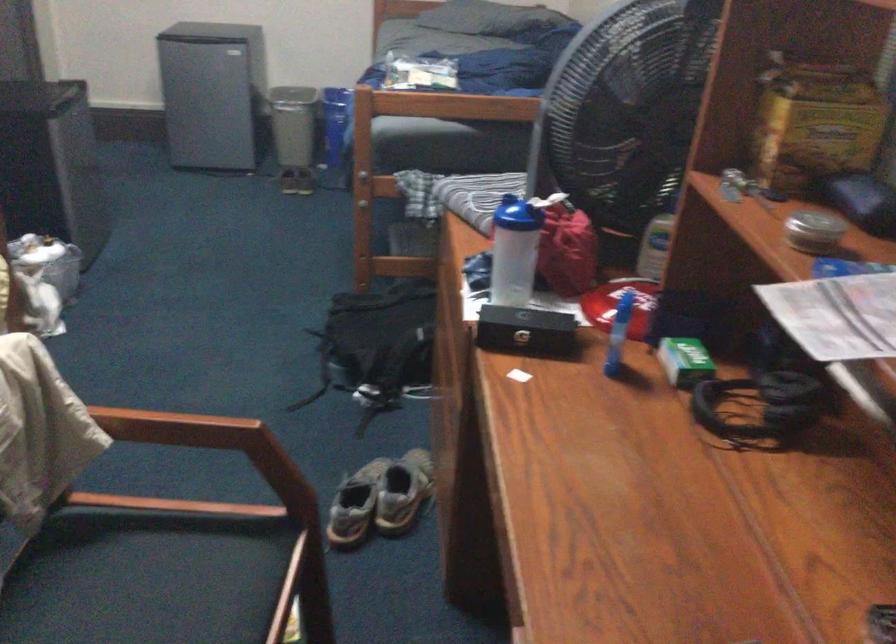
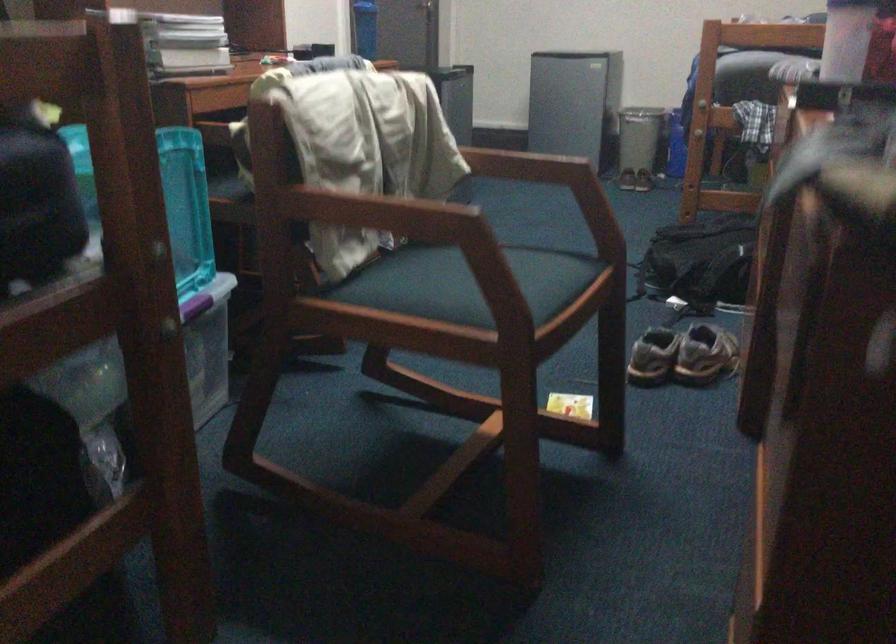
Locate, in the second image, the point that corresponds to (380,512) in the first image.

(682, 355)